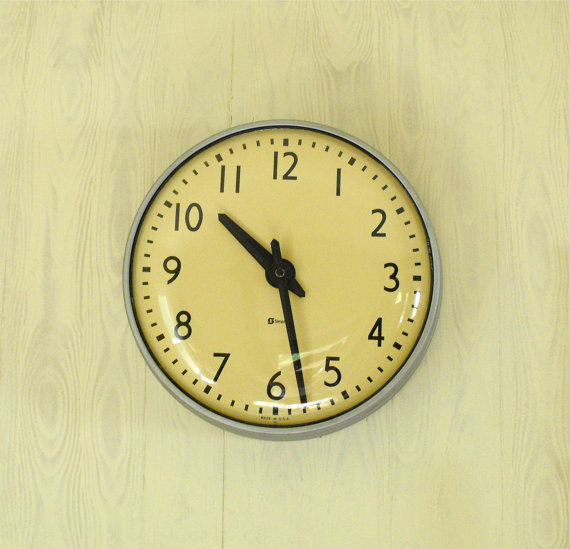
Locate an element on the screen. black interior border is located at coordinates (215, 145), (325, 418).